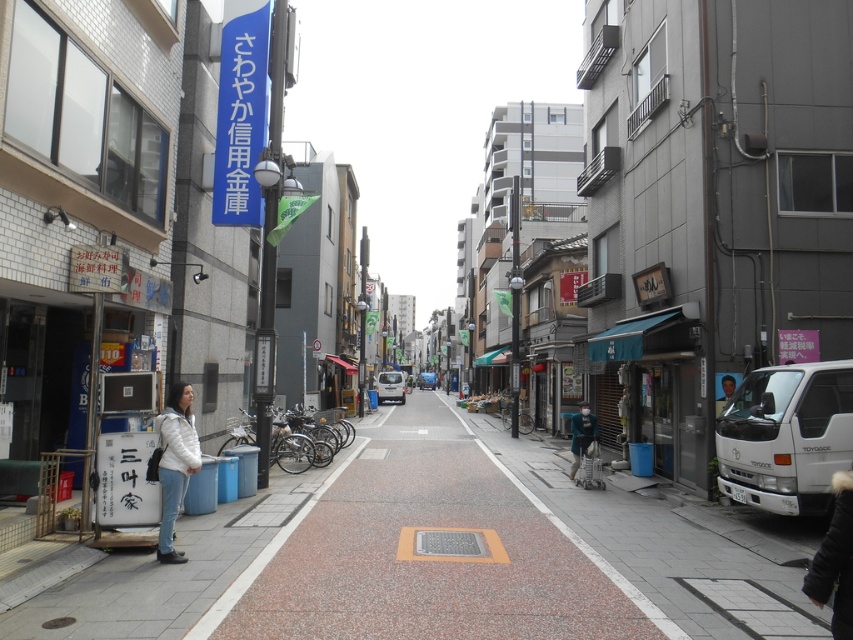
Question: Is blue fabric awning at lower right further to camera compared to metallic silver bicycles at center?

Choices:
 (A) yes
 (B) no

Answer: (B)

Question: Among these objects, which one is farthest from the camera?

Choices:
 (A) pebbled concrete sidewalk at center
 (B) metallic silver bicycles at center

Answer: (B)

Question: Can you confirm if pebbled concrete sidewalk at center is thinner than blue fabric awning at lower right?

Choices:
 (A) yes
 (B) no

Answer: (B)

Question: Which is farther from the teal fabric jacket at center?

Choices:
 (A) metallic silver bicycles at center
 (B) pebbled concrete sidewalk at center

Answer: (A)

Question: Which point is farther to the camera?

Choices:
 (A) (229, 436)
 (B) (648, 419)
 (C) (190, 458)
 (D) (592, 632)

Answer: (A)

Question: Is pebbled concrete sidewalk at center closer to camera compared to teal fabric jacket at center?

Choices:
 (A) no
 (B) yes

Answer: (B)